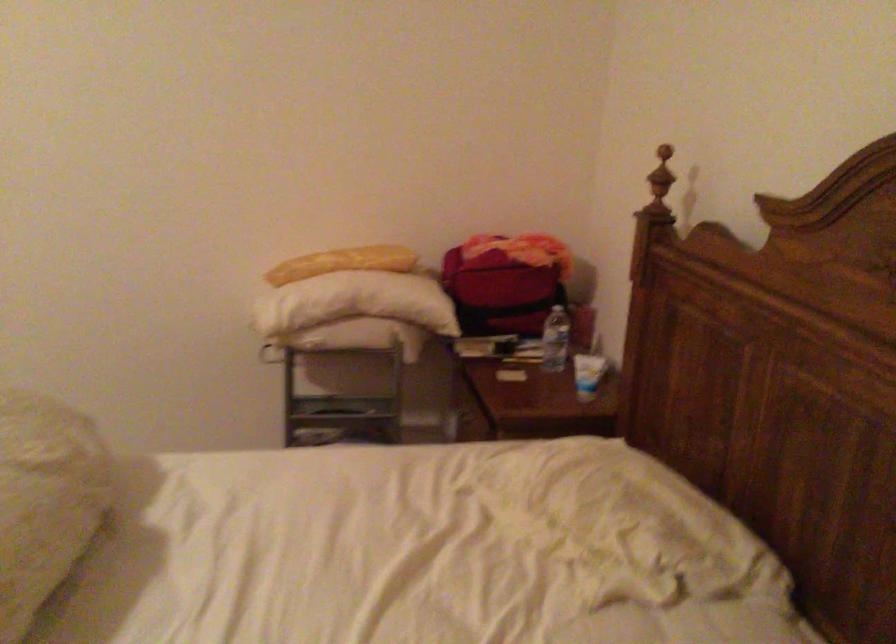
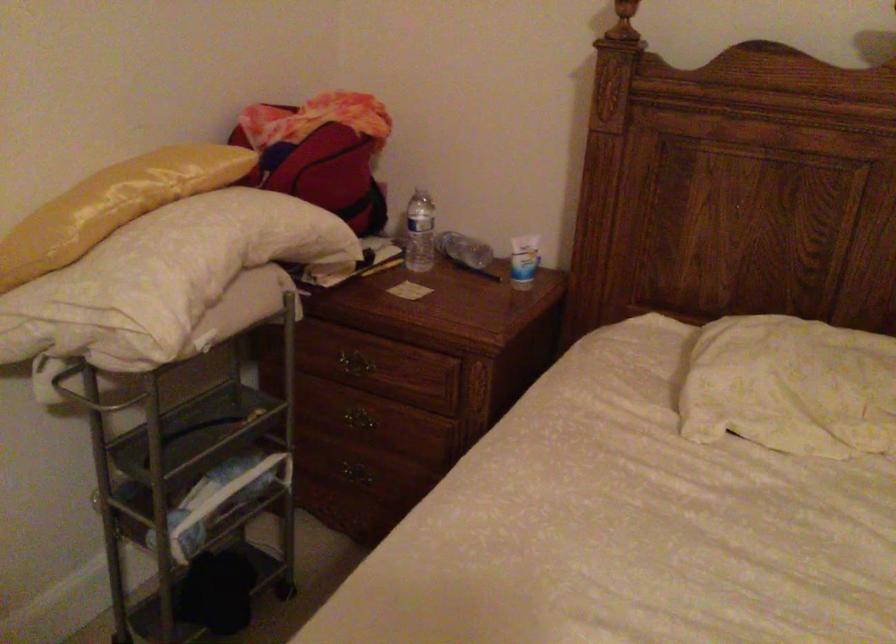
Locate, in the second image, the point that corresponds to (x=288, y=296) in the first image.

(164, 278)